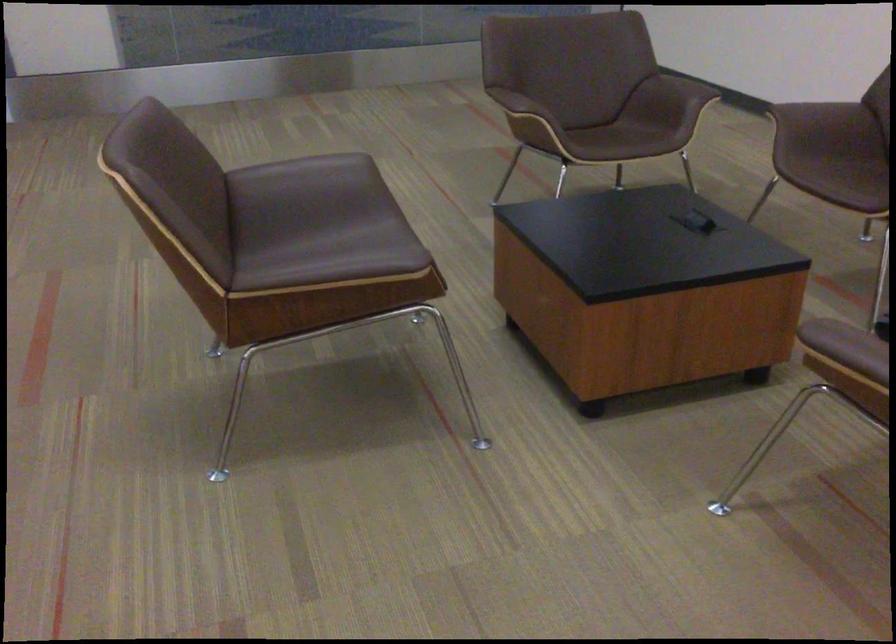
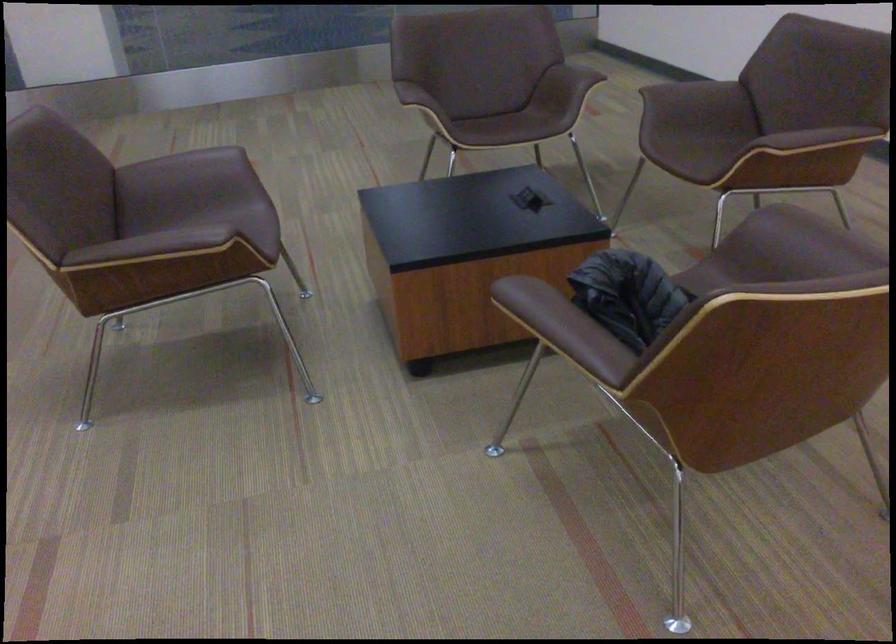
In a continuous first-person perspective shot, in which direction is the camera moving?

The cameraman moved toward right, backward.